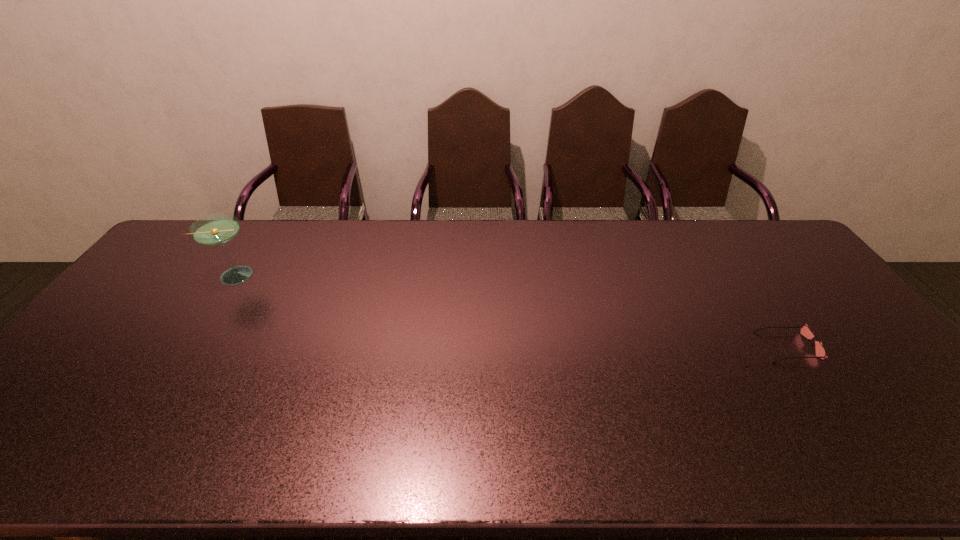
I want to click on blank area at the far right corner, so click(x=795, y=255).